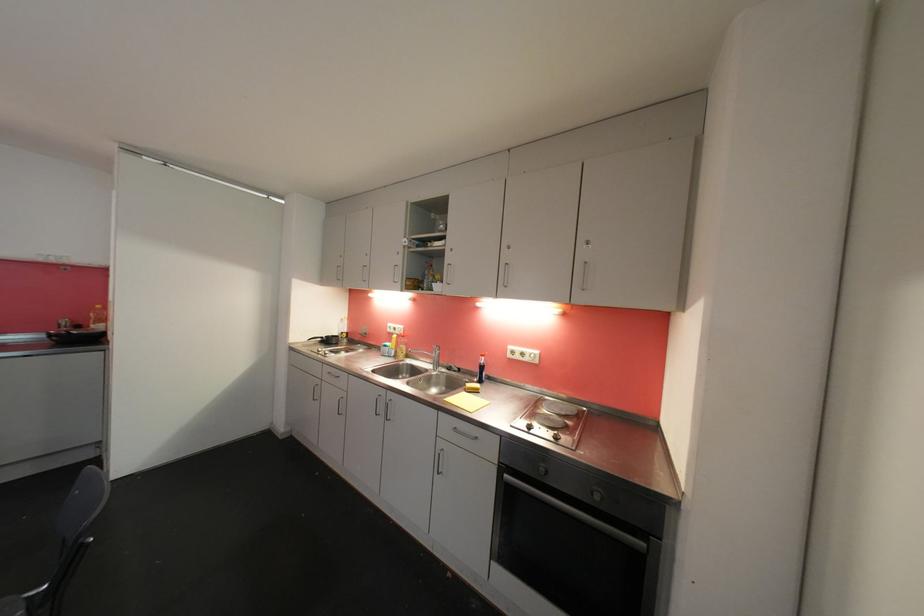
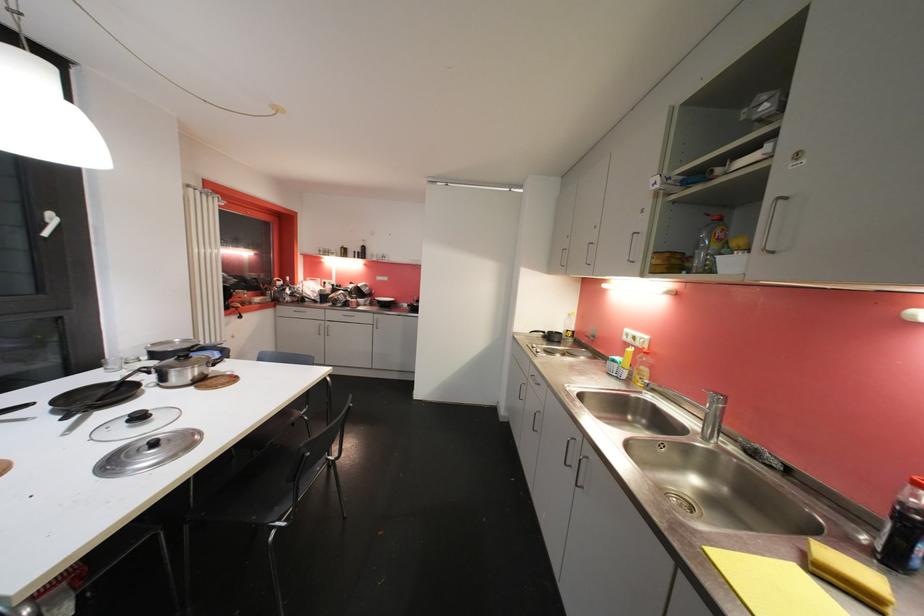
Question: The camera is either moving clockwise (left) or counter-clockwise (right) around the object. The first image is from the beginning of the video and the second image is from the end. Is the camera moving left or right when shooting the video?

Choices:
 (A) Left
 (B) Right

Answer: (B)